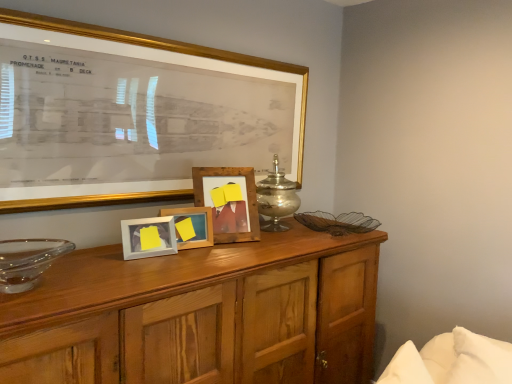
Locate an element on the screen. The image size is (512, 384). vacant space in front of wooden photo frame at center, the first picture frame when ordered from back to front is located at coordinates (218, 243).